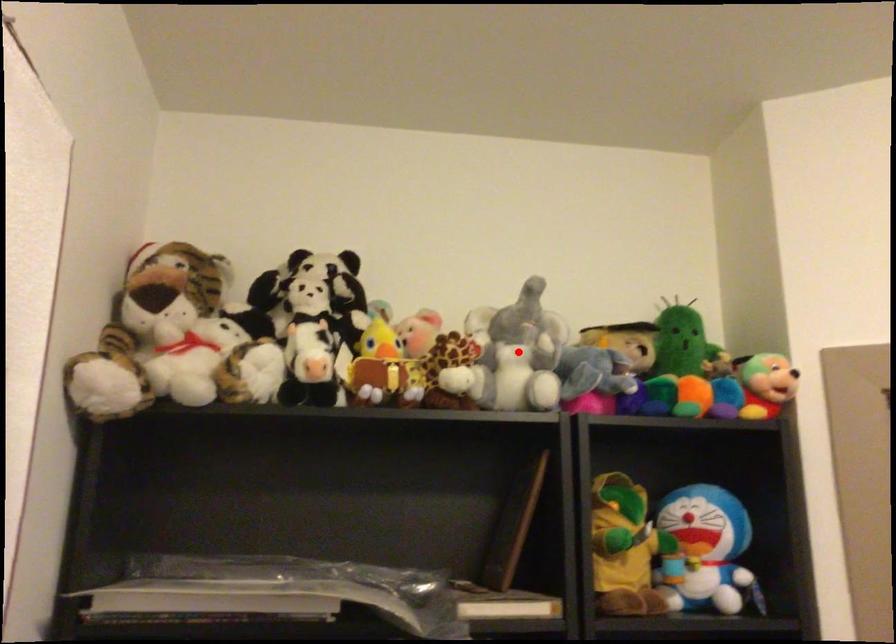
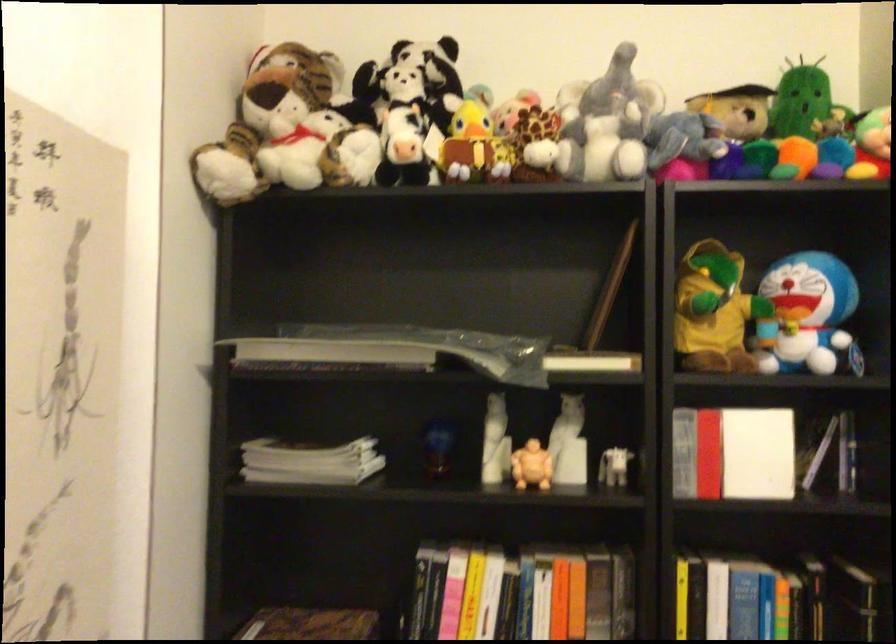
Find the pixel in the second image that matches the highlighted location in the first image.

(607, 122)